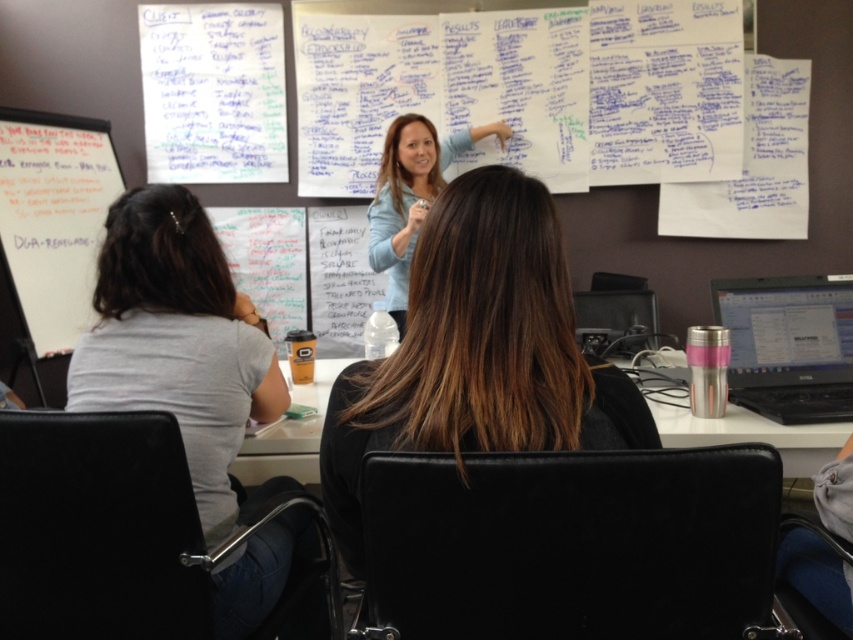
You are a photographer trying to capture a closeup of both the gray cotton shirt at left and the silver metallic laptop at right. Since you want to ensure both are in focus, which object should you adjust your camera focus to prioritize based on their sizes?

The gray cotton shirt at left has a larger width than the silver metallic laptop at right, so you should prioritize focusing on the gray cotton shirt at left to ensure both are in focus.

You are attending a meeting and see the brown hair at center and the light blue sweater at upper center. Which object is positioned lower in the scene?

The brown hair at center is located below light blue sweater at upper center, so the brown hair at center is positioned lower in the scene.